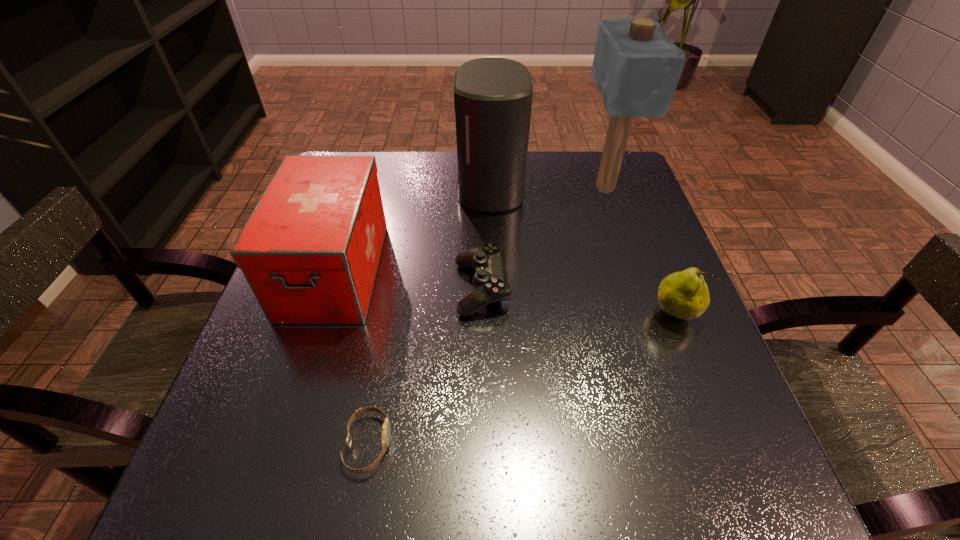
Where is `vacant area that satisfies the following two spatial constraints: 1. on the button side of the coffee maker; 2. on the handle side of the fourth shortest object`? Image resolution: width=960 pixels, height=540 pixels. vacant area that satisfies the following two spatial constraints: 1. on the button side of the coffee maker; 2. on the handle side of the fourth shortest object is located at coordinates (492, 271).

The image size is (960, 540). Find the location of `free space that satisfies the following two spatial constraints: 1. on the button side of the second tallest object; 2. on the handle side of the leftmost object`. free space that satisfies the following two spatial constraints: 1. on the button side of the second tallest object; 2. on the handle side of the leftmost object is located at coordinates (492, 271).